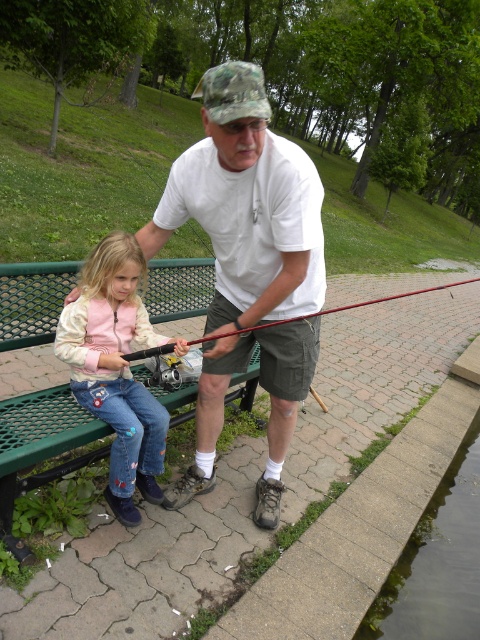
Question: Which of the following is the closest to the observer?

Choices:
 (A) (142, 269)
 (B) (69, 282)
 (C) (309, 314)
 (D) (233, 106)

Answer: (D)

Question: Does denim jeans at left have a lesser width compared to red fiberglass rod at center?

Choices:
 (A) no
 (B) yes

Answer: (B)

Question: Considering the relative positions of green metal bench at lower left and red fiberglass rod at center in the image provided, where is green metal bench at lower left located with respect to red fiberglass rod at center?

Choices:
 (A) right
 (B) left

Answer: (B)

Question: Which point is farther to the camera?

Choices:
 (A) green metal bench at lower left
 (B) white matte shirt at center
 (C) denim jeans at left

Answer: (C)

Question: Which point is closer to the camera?

Choices:
 (A) (170, 349)
 (B) (11, 492)
 (C) (165, 232)
 (D) (86, 272)

Answer: (B)

Question: Is white matte shirt at center thinner than red fiberglass rod at center?

Choices:
 (A) no
 (B) yes

Answer: (B)